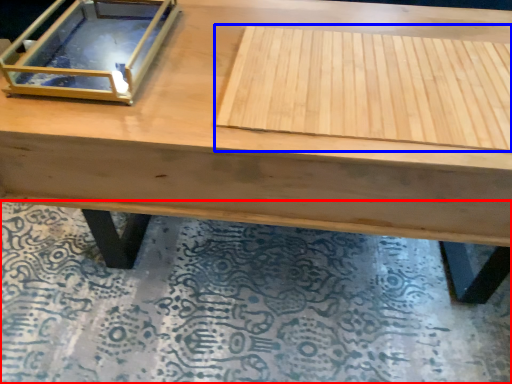
Question: Which point is closer to the camera, mat (highlighted by a red box) or plywood (highlighted by a blue box)?

Choices:
 (A) mat
 (B) plywood

Answer: (B)